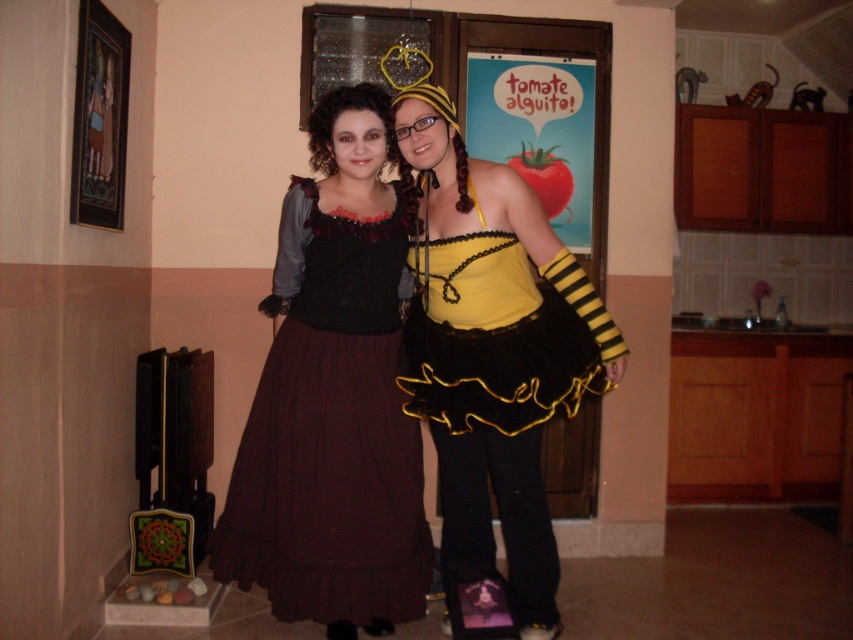
Between matte black dress at center and dark red satin dress at center, which one has less height?

Standing shorter between the two is dark red satin dress at center.

Measure the distance from matte black dress at center to dark red satin dress at center.

matte black dress at center is 3.46 inches from dark red satin dress at center.

The image size is (853, 640). In order to click on matte black dress at center in this screenshot , I will do `click(397, 381)`.